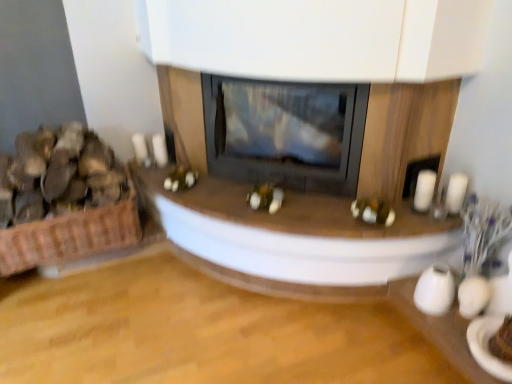
Question: Is woven brown basket at left wider or thinner than white matte candle at right, the first candle from the left?

Choices:
 (A) thin
 (B) wide

Answer: (B)

Question: Which is correct: woven brown basket at left is inside white matte candle at right, the first candle from the left, or outside of it?

Choices:
 (A) outside
 (B) inside

Answer: (A)

Question: Based on their relative distances, which object is nearer to the white matte candle at right, the second candle when ordered from right to left?

Choices:
 (A) brown woven basket at left
 (B) white glossy candle at right, which ranks as the 1th candle in right-to-left order
 (C) woven brown basket at left
 (D) black glass wood burning stove at center
 (E) wooden table at center

Answer: (B)

Question: Considering the real-world distances, which object is farthest from the white glossy candle at right, which ranks as the 1th candle in right-to-left order?

Choices:
 (A) wooden table at center
 (B) woven brown basket at left
 (C) black glass wood burning stove at center
 (D) white matte candle at right, the first candle from the left
 (E) brown woven basket at left

Answer: (E)